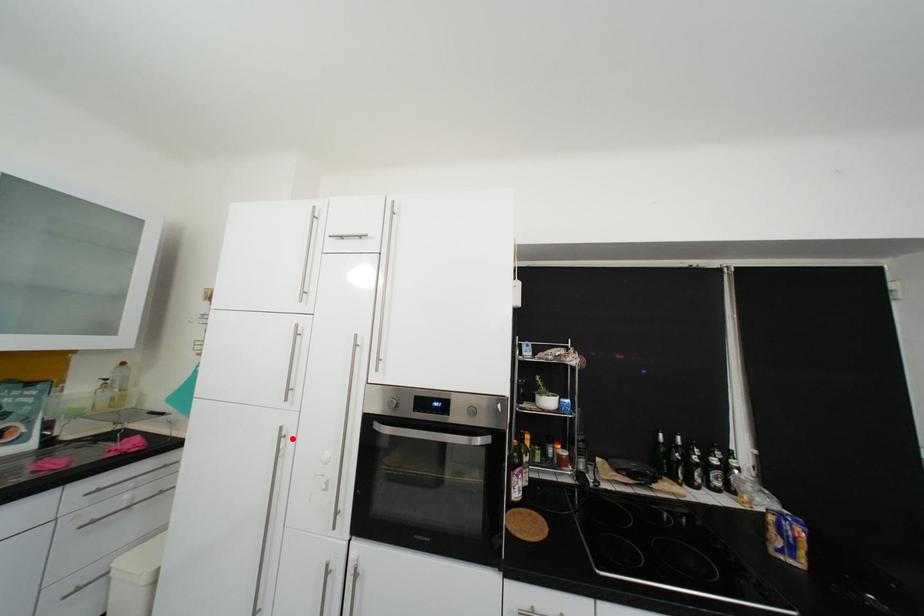
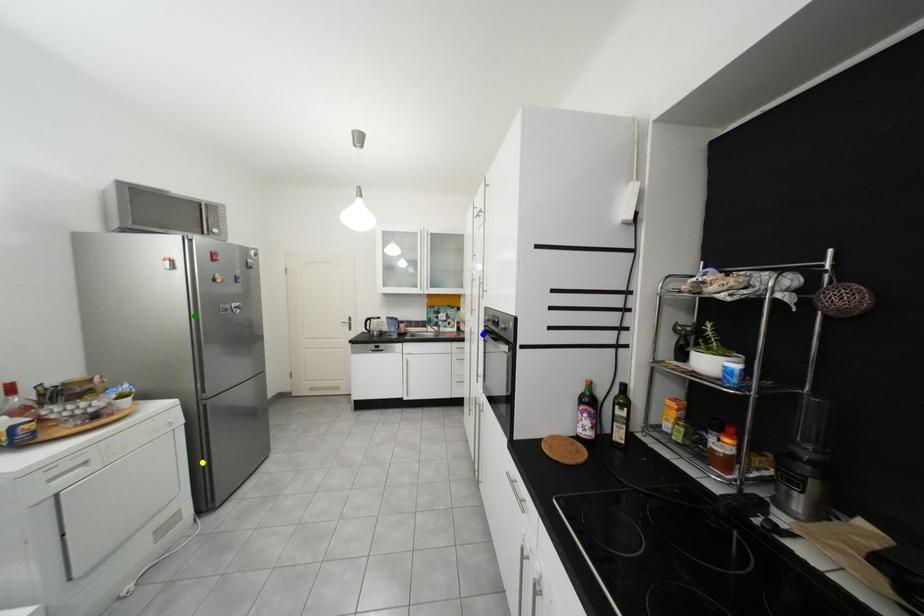
Question: I am providing you with two images of the same scene from different viewpoints. A red point is marked on the first image. You are given multiple points on the second image. Which mark in image 2 goes with the point in image 1?

Choices:
 (A) yellow point
 (B) blue point
 (C) green point

Answer: (B)